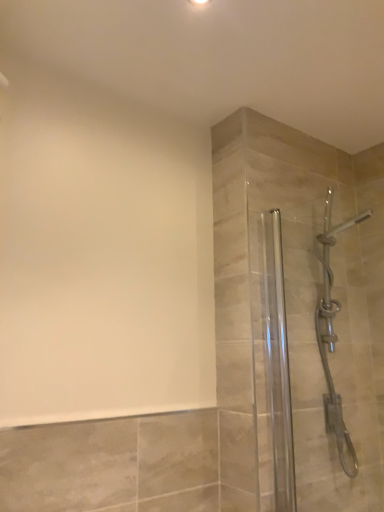
Where is `clear glass shower door at right`? This screenshot has width=384, height=512. clear glass shower door at right is located at coordinates (316, 365).

What do you see at coordinates (316, 365) in the screenshot? I see `clear glass shower door at right` at bounding box center [316, 365].

Measure the distance between point (347, 378) and camera.

They are 1.84 meters apart.

The height and width of the screenshot is (512, 384). I want to click on clear glass shower door at right, so click(x=316, y=365).